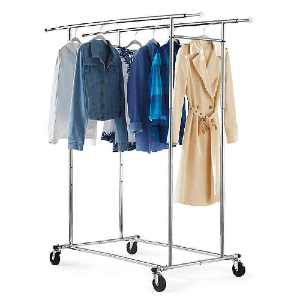
Identify the location of rods. point(161,16), point(202,22), point(179,38), point(171,32), point(221,31), point(72,162), point(122,163).